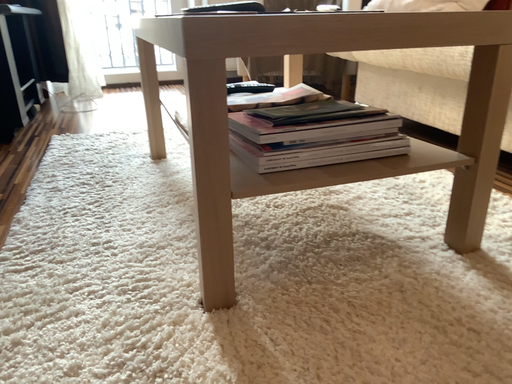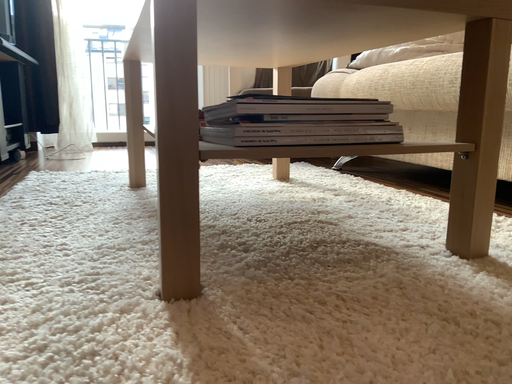
Question: Which way did the camera rotate in the video?

Choices:
 (A) rotated upward
 (B) rotated downward

Answer: (A)